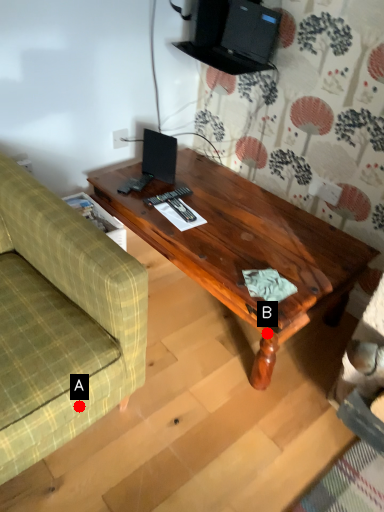
Question: Two points are circled on the image, labeled by A and B beside each circle. Which point appears closest to the camera in this image?

Choices:
 (A) A is closer
 (B) B is closer

Answer: (A)